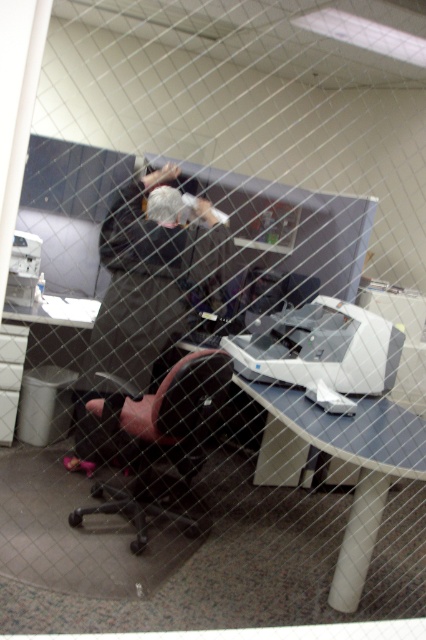
Does point (157, 312) come closer to viewer compared to point (124, 440)?

That is False.

Where is `dark gray coat at center`? Image resolution: width=426 pixels, height=640 pixels. dark gray coat at center is located at coordinates (143, 292).

Does point (85, 433) come behind point (215, 371)?

Yes, it is behind point (215, 371).

Find the location of `dark gray coat at center`. dark gray coat at center is located at coordinates (143, 292).

Looking at this image, between dark gray coat at center and white plastic printer at center, which one has less height?

white plastic printer at center

Locate an element on the screen. The image size is (426, 640). dark gray coat at center is located at coordinates (143, 292).

Does white plastic printer at center have a smaller size compared to black leather swivel chair at center?

No, white plastic printer at center is not smaller than black leather swivel chair at center.

Does white plastic printer at center have a lesser width compared to black leather swivel chair at center?

No, white plastic printer at center is not thinner than black leather swivel chair at center.

Locate an element on the screen. The image size is (426, 640). white plastic printer at center is located at coordinates (340, 460).